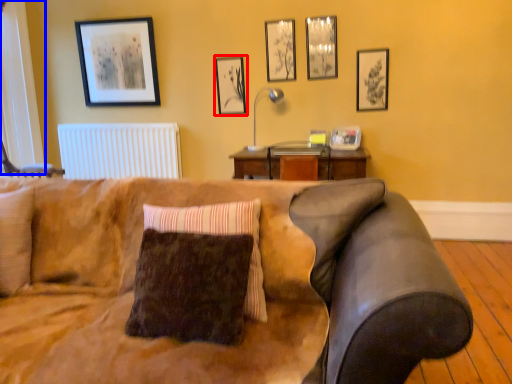
Question: Which object appears closest to the camera in this image, picture frame (highlighted by a red box) or window (highlighted by a blue box)?

Choices:
 (A) picture frame
 (B) window

Answer: (B)